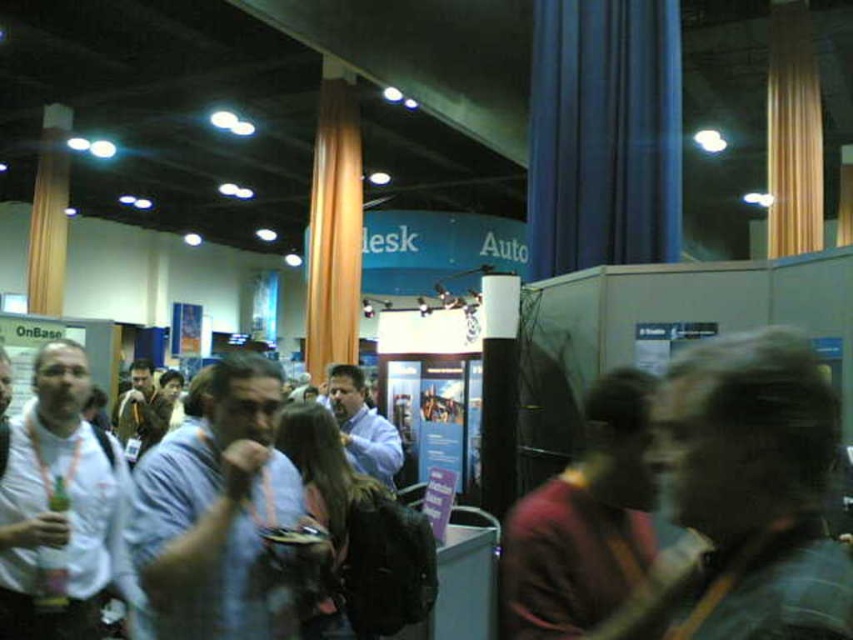
The height and width of the screenshot is (640, 853). What do you see at coordinates (57, 509) in the screenshot?
I see `white matte shirt at left` at bounding box center [57, 509].

Can you confirm if white matte shirt at left is positioned to the right of maroon fabric shirt at center?

Incorrect, white matte shirt at left is not on the right side of maroon fabric shirt at center.

Who is more forward, (x=113, y=481) or (x=532, y=634)?

Positioned in front is point (x=532, y=634).

The width and height of the screenshot is (853, 640). In order to click on white matte shirt at left in this screenshot , I will do `click(57, 509)`.

This screenshot has width=853, height=640. What do you see at coordinates (218, 512) in the screenshot? I see `light blue shirt at center` at bounding box center [218, 512].

Identify the location of light blue shirt at center. (218, 512).

Which is in front, point (215, 509) or point (114, 474)?

Point (215, 509)

Locate an element on the screen. light blue shirt at center is located at coordinates (218, 512).

Does light blue shirt at center have a lesser height compared to maroon fabric shirt at center?

Incorrect, light blue shirt at center's height does not fall short of maroon fabric shirt at center's.

Measure the distance between point (194,589) and camera.

Point (194,589) is 1.78 meters from camera.

Image resolution: width=853 pixels, height=640 pixels. In order to click on light blue shirt at center in this screenshot , I will do `click(218, 512)`.